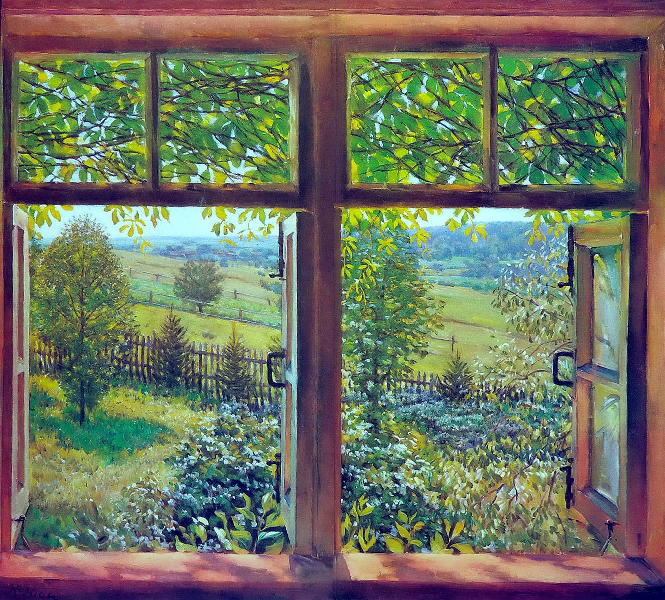
Find the location of `window sill`. window sill is located at coordinates (477, 569).